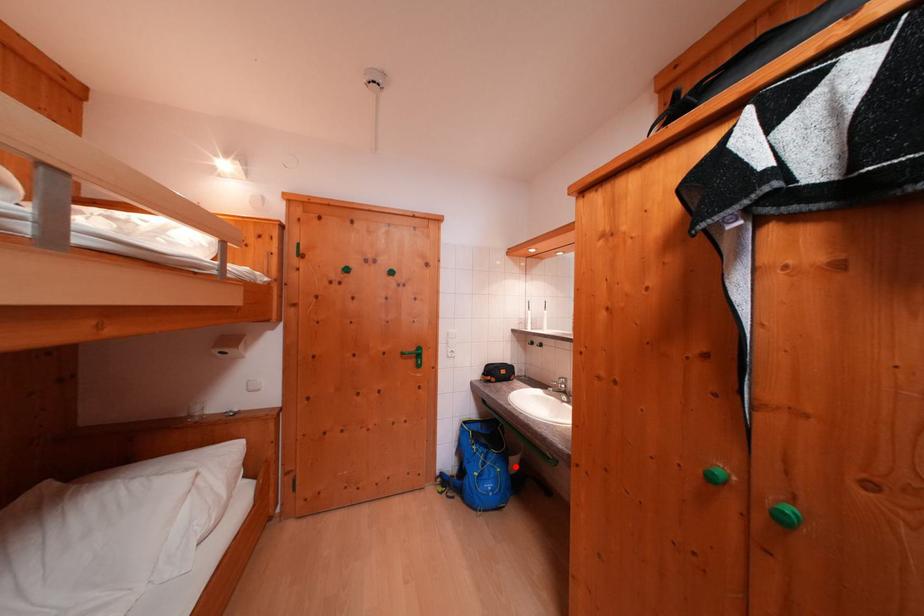
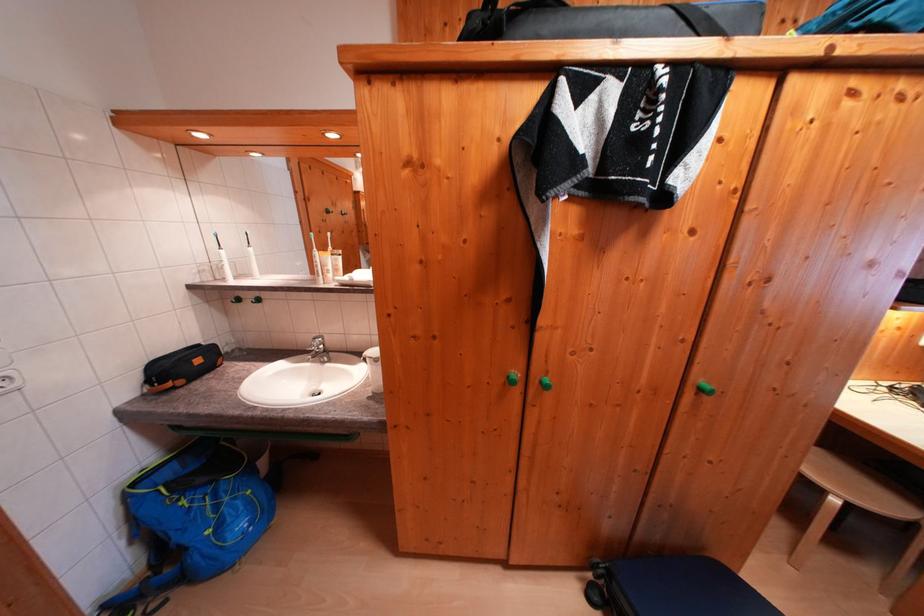
Question: A red point is marked in image1. In image2, is the corresponding 3D point closer to the camera or farther? Reply with the corresponding letter.

Choices:
 (A) The corresponding 3D point is closer.
 (B) The corresponding 3D point is farther.

Answer: (A)